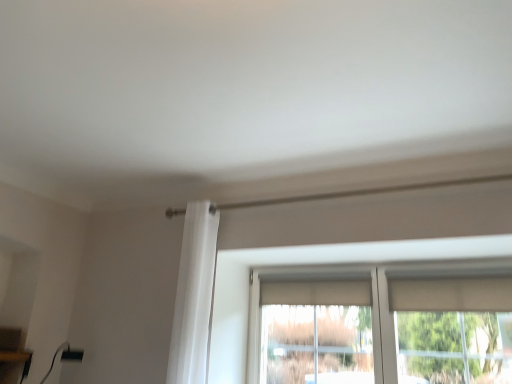
What is the approximate width of white sheer curtain at upper center?

The width of white sheer curtain at upper center is 9.02 inches.

The width and height of the screenshot is (512, 384). What do you see at coordinates (194, 296) in the screenshot?
I see `white sheer curtain at upper center` at bounding box center [194, 296].

You are a GUI agent. You are given a task and a screenshot of the screen. Output one action in this format:
    pyautogui.click(x=<x>, y=<y>)
    Task: Click on the white sheer curtain at upper center
    The image size is (512, 384).
    Given the screenshot: What is the action you would take?
    click(x=194, y=296)

Where is `white sheer curtain at upper center`? white sheer curtain at upper center is located at coordinates (194, 296).